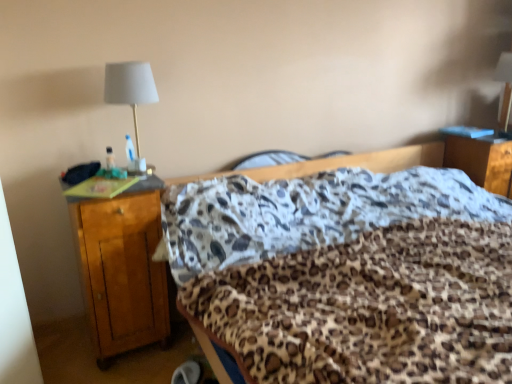
What is the approximate width of matte white lampshade at upper left?

It is 10.46 inches.

Identify the location of leopard print fabric at center. (339, 164).

Is wooden nightstand at lower right, which is counted as the 2th nightstand, starting from the front, located within leopard print fabric at center?

That's incorrect, wooden nightstand at lower right, which is counted as the 2th nightstand, starting from the front, is not inside leopard print fabric at center.

In the image, is leopard print fabric at center positioned in front of or behind wooden nightstand at lower right, the 1th nightstand positioned from the back?

leopard print fabric at center is in front of wooden nightstand at lower right, the 1th nightstand positioned from the back.

Consider the image. Considering the relative sizes of leopard print fabric at center and wooden nightstand at lower right, the second nightstand positioned from the left, in the image provided, is leopard print fabric at center wider than wooden nightstand at lower right, the second nightstand positioned from the left,?

Correct, the width of leopard print fabric at center exceeds that of wooden nightstand at lower right, the second nightstand positioned from the left.

Are wooden nightstand at left, which is the second nightstand in right-to-left order, and matte white lampshade at upper left located far from each other?

wooden nightstand at left, which is the second nightstand in right-to-left order, is near matte white lampshade at upper left, not far away.

Which is behind, wooden nightstand at left, the 1th nightstand in the front-to-back sequence, or matte white lampshade at upper left?

matte white lampshade at upper left is more distant.

Is point (94, 273) farther from camera compared to point (128, 167)?

No.

Consider the image. From a real-world perspective, relative to matte white lampshade at upper left, is wooden nightstand at left, marked as the 1th nightstand in a left-to-right arrangement, vertically above or below?

From a real-world perspective, wooden nightstand at left, marked as the 1th nightstand in a left-to-right arrangement, is physically below matte white lampshade at upper left.

Can you confirm if wooden nightstand at lower right, the second nightstand positioned from the left, is shorter than wooden nightstand at left, acting as the 2th nightstand starting from the back?

Yes, wooden nightstand at lower right, the second nightstand positioned from the left, is shorter than wooden nightstand at left, acting as the 2th nightstand starting from the back.

From a real-world perspective, which object stands above the other?

wooden nightstand at lower right, the 1th nightstand positioned from the back, is physically above.

From the image's perspective, which is below, wooden nightstand at lower right, the 1th nightstand when ordered from right to left, or wooden nightstand at left, the 1th nightstand in the front-to-back sequence?

wooden nightstand at left, the 1th nightstand in the front-to-back sequence, appears lower in the image.

Is point (499, 166) in front of point (153, 180)?

No, (499, 166) is further to viewer.

Considering the relative sizes of leopard print fabric at center and wooden nightstand at left, the 1th nightstand in the front-to-back sequence, in the image provided, is leopard print fabric at center bigger than wooden nightstand at left, the 1th nightstand in the front-to-back sequence,?

Correct, leopard print fabric at center is larger in size than wooden nightstand at left, the 1th nightstand in the front-to-back sequence.

Which is in front, leopard print fabric at center or wooden nightstand at left, marked as the 1th nightstand in a left-to-right arrangement?

leopard print fabric at center is in front.

From the picture: From the image's perspective, is leopard print fabric at center beneath wooden nightstand at left, the 1th nightstand in the front-to-back sequence?

Indeed, from the image's perspective, leopard print fabric at center is shown beneath wooden nightstand at left, the 1th nightstand in the front-to-back sequence.

Is leopard print fabric at center surrounding wooden nightstand at left, the 1th nightstand in the front-to-back sequence?

No.

Who is bigger, wooden nightstand at left, acting as the 2th nightstand starting from the back, or wooden nightstand at lower right, the 1th nightstand when ordered from right to left?

Bigger between the two is wooden nightstand at left, acting as the 2th nightstand starting from the back.

From the image's perspective, which is above, wooden nightstand at left, marked as the 1th nightstand in a left-to-right arrangement, or wooden nightstand at lower right, the second nightstand positioned from the left?

From the image's view, wooden nightstand at lower right, the second nightstand positioned from the left, is above.

Is wooden nightstand at left, the 1th nightstand in the front-to-back sequence, facing towards wooden nightstand at lower right, the 1th nightstand positioned from the back?

No.

From a real-world perspective, who is located lower, wooden nightstand at left, which is the second nightstand in right-to-left order, or wooden nightstand at lower right, the 1th nightstand positioned from the back?

wooden nightstand at left, which is the second nightstand in right-to-left order, from a real-world perspective.

Which of these two, wooden nightstand at lower right, which is counted as the 2th nightstand, starting from the front, or matte white lampshade at upper left, is thinner?

Thinner between the two is matte white lampshade at upper left.

Is wooden nightstand at lower right, the 1th nightstand positioned from the back, closer to camera compared to matte white lampshade at upper left?

No, it is behind matte white lampshade at upper left.

Considering the sizes of wooden nightstand at lower right, the second nightstand positioned from the left, and matte white lampshade at upper left in the image, is wooden nightstand at lower right, the second nightstand positioned from the left, bigger or smaller than matte white lampshade at upper left?

Considering their sizes, wooden nightstand at lower right, the second nightstand positioned from the left, takes up more space than matte white lampshade at upper left.

Find the location of a particular element. Image resolution: width=512 pixels, height=384 pixels. nightstand behind the matte white lampshade at upper left is located at coordinates (481, 162).

How different are the orientations of leopard print fabric at center and matte white lampshade at upper left in degrees?

The angular difference between leopard print fabric at center and matte white lampshade at upper left is 4.49 degrees.

Which object is thinner, leopard print fabric at center or matte white lampshade at upper left?

matte white lampshade at upper left.

Which object is positioned more to the left, leopard print fabric at center or matte white lampshade at upper left?

matte white lampshade at upper left is more to the left.

Is matte white lampshade at upper left at the back of leopard print fabric at center?

No, leopard print fabric at center is not facing the opposite direction of matte white lampshade at upper left.

Find the location of a particular element. This screenshot has height=384, width=512. the 2nd nightstand located above the leopard print fabric at center (from a real-world perspective) is located at coordinates (481, 162).

Identify the location of bedside lamp on the right of wooden nightstand at left, the 1th nightstand in the front-to-back sequence. The width and height of the screenshot is (512, 384). (131, 96).

Considering their positions, is wooden nightstand at left, marked as the 1th nightstand in a left-to-right arrangement, positioned closer to matte white lampshade at upper left than wooden nightstand at lower right, which is counted as the 2th nightstand, starting from the front?

wooden nightstand at left, marked as the 1th nightstand in a left-to-right arrangement, lies closer to matte white lampshade at upper left than the other object.

When comparing their distances from wooden nightstand at lower right, which is counted as the 2th nightstand, starting from the front, does leopard print fabric at center or matte white lampshade at upper left seem closer?

Among the two, leopard print fabric at center is located nearer to wooden nightstand at lower right, which is counted as the 2th nightstand, starting from the front.

Based on the photo, considering their positions, is wooden nightstand at left, the 1th nightstand in the front-to-back sequence, positioned further to leopard print fabric at center than matte white lampshade at upper left?

matte white lampshade at upper left.

When comparing their distances from matte white lampshade at upper left, does wooden nightstand at lower right, the second nightstand positioned from the left, or wooden nightstand at left, the 1th nightstand in the front-to-back sequence, seem further?

wooden nightstand at lower right, the second nightstand positioned from the left, lies further to matte white lampshade at upper left than the other object.

From the image, which object appears to be farther from leopard print fabric at center, wooden nightstand at left, which is the second nightstand in right-to-left order, or wooden nightstand at lower right, the 1th nightstand positioned from the back?

wooden nightstand at left, which is the second nightstand in right-to-left order, lies further to leopard print fabric at center than the other object.

Looking at the image, which one is located further to wooden nightstand at left, the 1th nightstand in the front-to-back sequence, leopard print fabric at center or matte white lampshade at upper left?

leopard print fabric at center.

Which object lies further to the anchor point matte white lampshade at upper left, leopard print fabric at center or wooden nightstand at left, acting as the 2th nightstand starting from the back?

The object further to matte white lampshade at upper left is leopard print fabric at center.

When comparing their distances from wooden nightstand at lower right, the 1th nightstand when ordered from right to left, does matte white lampshade at upper left or leopard print fabric at center seem closer?

The object closer to wooden nightstand at lower right, the 1th nightstand when ordered from right to left, is leopard print fabric at center.

Locate an element on the screen. Image resolution: width=512 pixels, height=384 pixels. bedside lamp between wooden nightstand at left, the 1th nightstand in the front-to-back sequence, and leopard print fabric at center is located at coordinates (131, 96).

What are the coordinates of `bed between matte white lampshade at upper left and wooden nightstand at lower right, the 1th nightstand positioned from the back` in the screenshot? It's located at pos(339,164).

At what (x,y) coordinates should I click in order to perform the action: click on bedside lamp between wooden nightstand at left, which is the second nightstand in right-to-left order, and wooden nightstand at lower right, the 1th nightstand when ordered from right to left, in the horizontal direction. Please return your answer as a coordinate pair (x, y). Looking at the image, I should click on (131, 96).

Where is `bed between wooden nightstand at left, marked as the 1th nightstand in a left-to-right arrangement, and wooden nightstand at lower right, the second nightstand positioned from the left, from left to right`? bed between wooden nightstand at left, marked as the 1th nightstand in a left-to-right arrangement, and wooden nightstand at lower right, the second nightstand positioned from the left, from left to right is located at coordinates (339, 164).